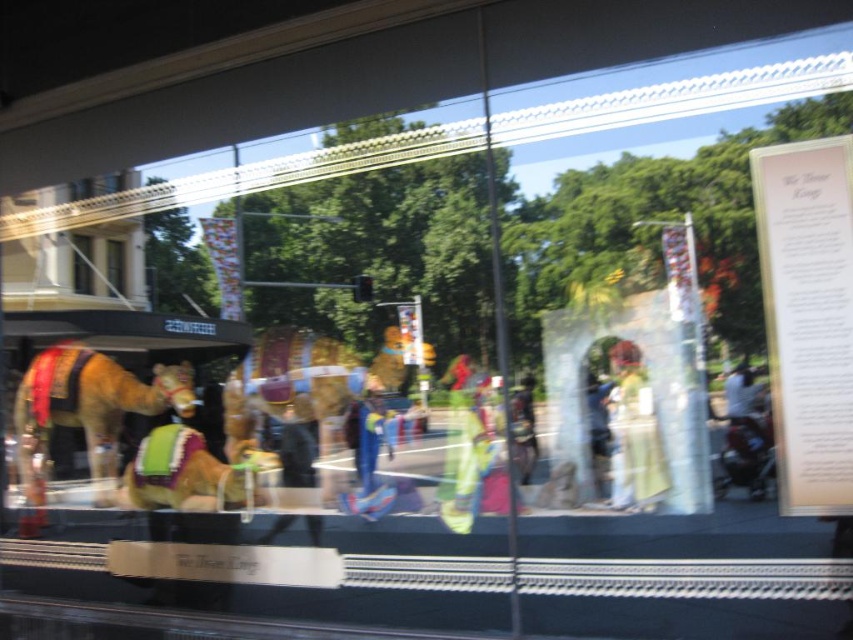
Does point (833, 474) come farther from viewer compared to point (74, 291)?

No.

Measure the distance between white paper at upper right and matte brown camel at left.

white paper at upper right is 9.67 feet away from matte brown camel at left.

This screenshot has height=640, width=853. Describe the element at coordinates (808, 316) in the screenshot. I see `white paper at upper right` at that location.

Locate an element on the screen. The height and width of the screenshot is (640, 853). white paper at upper right is located at coordinates [808, 316].

Between shiny golden camel at left and green velvet camel at center, which one has more height?

shiny golden camel at left is taller.

Does shiny golden camel at left appear on the right side of green velvet camel at center?

Incorrect, shiny golden camel at left is not on the right side of green velvet camel at center.

Locate an element on the screen. shiny golden camel at left is located at coordinates (86, 408).

This screenshot has width=853, height=640. I want to click on shiny golden camel at left, so point(86,408).

Is blue denim jeans at center thinner than transparent glass window at center?

Correct, blue denim jeans at center's width is less than transparent glass window at center's.

Can you confirm if blue denim jeans at center is wider than transparent glass window at center?

No.

Which is behind, point (598, 392) or point (109, 273)?

The point (109, 273) is behind.

Where is `blue denim jeans at center`? The width and height of the screenshot is (853, 640). blue denim jeans at center is located at coordinates (599, 428).